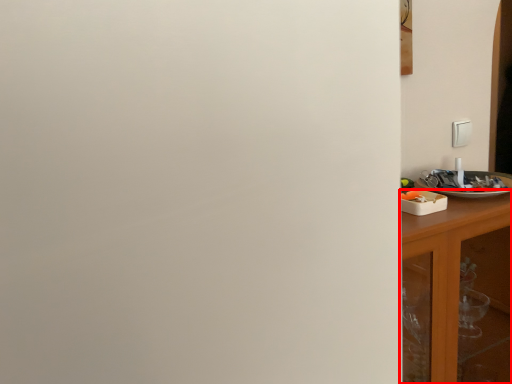
Question: From the image's perspective, what is the correct spatial relationship of cabinetry (annotated by the red box) in relation to tableware?

Choices:
 (A) above
 (B) below

Answer: (B)